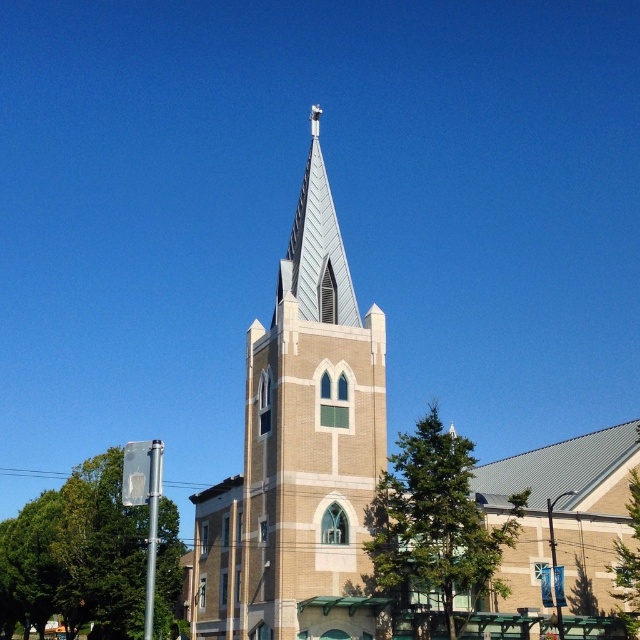
You are standing in front of the church and want to take a photo of both the brown brick church steeple at center and the metallic silver spire at upper center. Which one will appear larger in your photo?

The brown brick church steeple at center will appear larger in the photo because it is closer to the viewer than the metallic silver spire at upper center.

You are an architect evaluating the church design. You notice the brown brick church steeple at center and the metallic silver spire at upper center. Which structure is taller?

The metallic silver spire at upper center is taller than the brown brick church steeple at center.

You are standing in front of the church and want to take a photo of the white textured steeple at center. If your camera can focus on objects up to 40 meters away, will you be able to capture the steeple clearly?

The white textured steeple at center is 42.51 meters away from the camera, which is beyond the camera focus limit of 40 meters. Therefore, you might not be able to capture the steeple clearly.